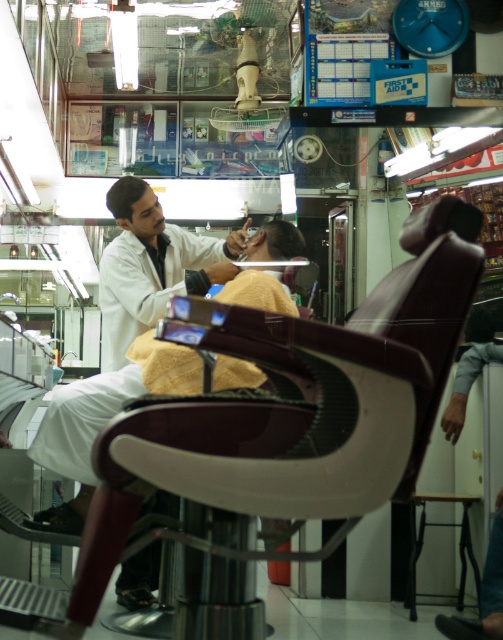
Can you confirm if yellow towel at center is positioned below shiny black hair at center?

Yes, yellow towel at center is below shiny black hair at center.

Which is in front, point (246, 371) or point (283, 237)?

Point (246, 371) is in front.

Where is `yellow towel at center`? The height and width of the screenshot is (640, 503). yellow towel at center is located at coordinates (111, 401).

Between point (228, 237) and point (279, 227), which one is positioned behind?

The point (228, 237) is more distant.

Can you confirm if white matte barber at center is smaller than shiny black hair at center?

Incorrect, white matte barber at center is not smaller in size than shiny black hair at center.

Image resolution: width=503 pixels, height=640 pixels. Describe the element at coordinates (152, 266) in the screenshot. I see `white matte barber at center` at that location.

Locate an element on the screen. white matte barber at center is located at coordinates (152, 266).

Who is more distant from viewer, (x=85, y=412) or (x=443, y=499)?

Point (x=443, y=499)

Can you confirm if yellow towel at center is positioned below metallic stool at lower right?

No, yellow towel at center is not below metallic stool at lower right.

At what (x,y) coordinates should I click in order to perform the action: click on yellow towel at center. Please return your answer as a coordinate pair (x, y). This screenshot has height=640, width=503. Looking at the image, I should click on (111, 401).